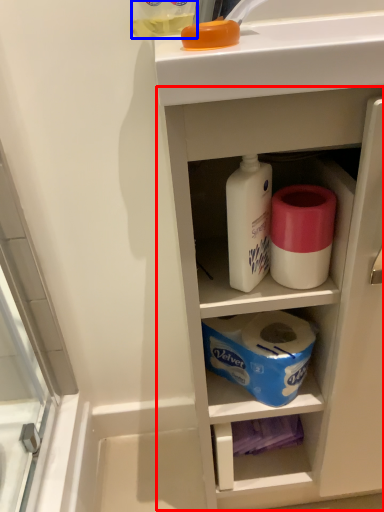
Question: Which point is further to the camera, cabinetry (highlighted by a red box) or bottle (highlighted by a blue box)?

Choices:
 (A) cabinetry
 (B) bottle

Answer: (B)